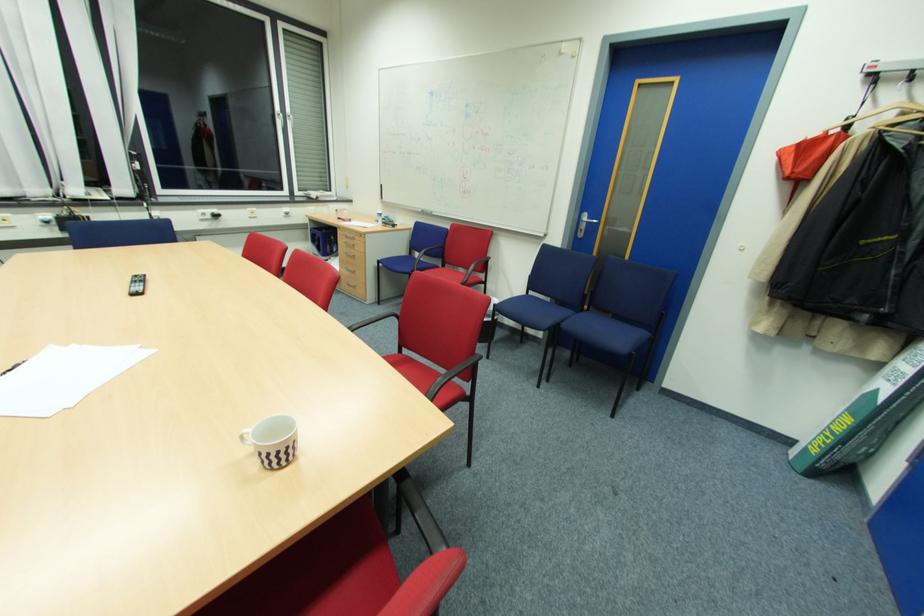
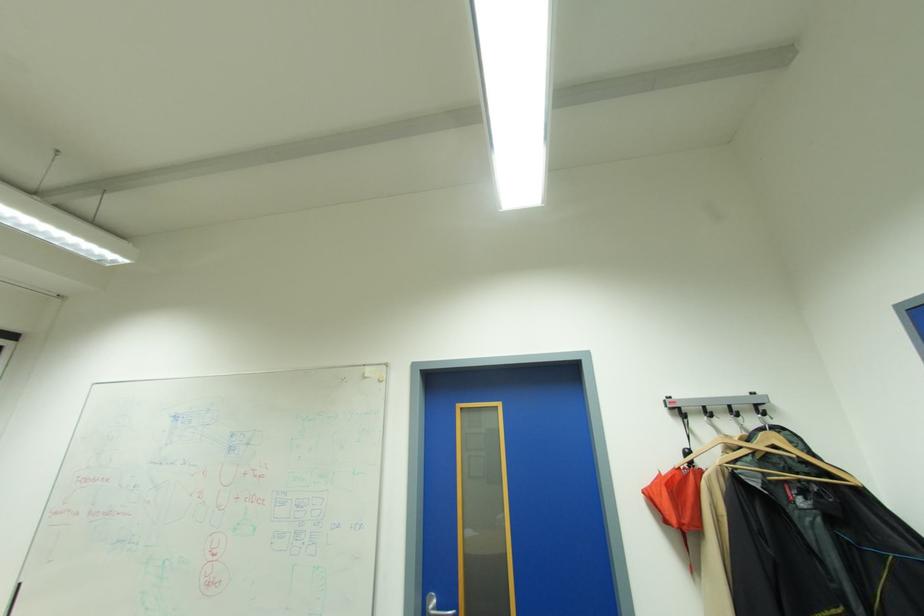
Find the pixel in the second image that matches point (815, 140) in the first image.

(667, 474)